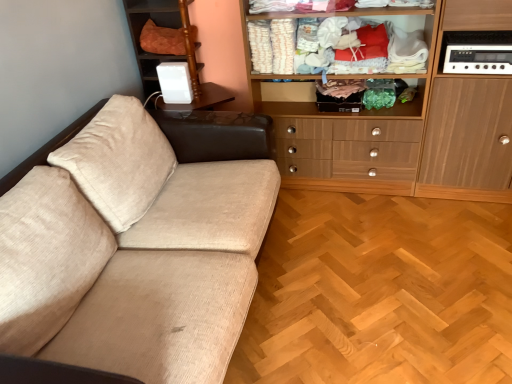
Question: Is white plastic stereo at upper right, the 2th appliance positioned from the back, taller than wooden cabinet at upper right, marked as the first cabinetry in a left-to-right arrangement?

Choices:
 (A) no
 (B) yes

Answer: (A)

Question: From a real-world perspective, is white plastic stereo at upper right, marked as the second appliance in a left-to-right arrangement, on top of wooden cabinet at upper right, marked as the first cabinetry in a left-to-right arrangement?

Choices:
 (A) yes
 (B) no

Answer: (A)

Question: Considering the relative positions of white plastic stereo at upper right, acting as the first appliance starting from the right, and wooden cabinet at upper right, the second cabinetry viewed from the right, in the image provided, is white plastic stereo at upper right, acting as the first appliance starting from the right, to the left of wooden cabinet at upper right, the second cabinetry viewed from the right, from the viewer's perspective?

Choices:
 (A) yes
 (B) no

Answer: (B)

Question: Does white plastic stereo at upper right, marked as the second appliance in a left-to-right arrangement, lie behind wooden cabinet at upper right, marked as the first cabinetry in a left-to-right arrangement?

Choices:
 (A) no
 (B) yes

Answer: (B)

Question: Does white plastic stereo at upper right, the 2th appliance positioned from the back, have a larger size compared to wooden cabinet at upper right, marked as the first cabinetry in a left-to-right arrangement?

Choices:
 (A) no
 (B) yes

Answer: (A)

Question: Considering the relative positions of white plastic stereo at upper right, marked as the second appliance in a left-to-right arrangement, and wooden cabinet at upper right, the second cabinetry viewed from the right, in the image provided, is white plastic stereo at upper right, marked as the second appliance in a left-to-right arrangement, in front of wooden cabinet at upper right, the second cabinetry viewed from the right,?

Choices:
 (A) yes
 (B) no

Answer: (B)

Question: Considering the relative sizes of light brown wood cabinet at right, the 1th cabinetry in the right-to-left sequence, and white plastic stereo at upper right, marked as the second appliance in a left-to-right arrangement, in the image provided, is light brown wood cabinet at right, the 1th cabinetry in the right-to-left sequence, bigger than white plastic stereo at upper right, marked as the second appliance in a left-to-right arrangement,?

Choices:
 (A) no
 (B) yes

Answer: (B)

Question: From the image's perspective, is light brown wood cabinet at right, the 1th cabinetry in the right-to-left sequence, over white plastic stereo at upper right, the 2th appliance positioned from the back?

Choices:
 (A) yes
 (B) no

Answer: (B)

Question: Does light brown wood cabinet at right, the 1th cabinetry in the right-to-left sequence, appear on the right side of white plastic stereo at upper right, the 2th appliance positioned from the back?

Choices:
 (A) yes
 (B) no

Answer: (A)

Question: Is light brown wood cabinet at right, placed as the second cabinetry when sorted from left to right, closer to camera compared to white plastic stereo at upper right, positioned as the 1th appliance in front-to-back order?

Choices:
 (A) yes
 (B) no

Answer: (A)

Question: Is light brown wood cabinet at right, the 1th cabinetry in the right-to-left sequence, aimed at white plastic stereo at upper right, the 2th appliance positioned from the back?

Choices:
 (A) no
 (B) yes

Answer: (B)

Question: Is light brown wood cabinet at right, the 1th cabinetry in the right-to-left sequence, not within white plastic stereo at upper right, the 2th appliance positioned from the back?

Choices:
 (A) yes
 (B) no

Answer: (A)

Question: Is wooden cabinet at upper right, the second cabinetry viewed from the right, positioned far away from orange quilted cushion at upper left?

Choices:
 (A) no
 (B) yes

Answer: (B)